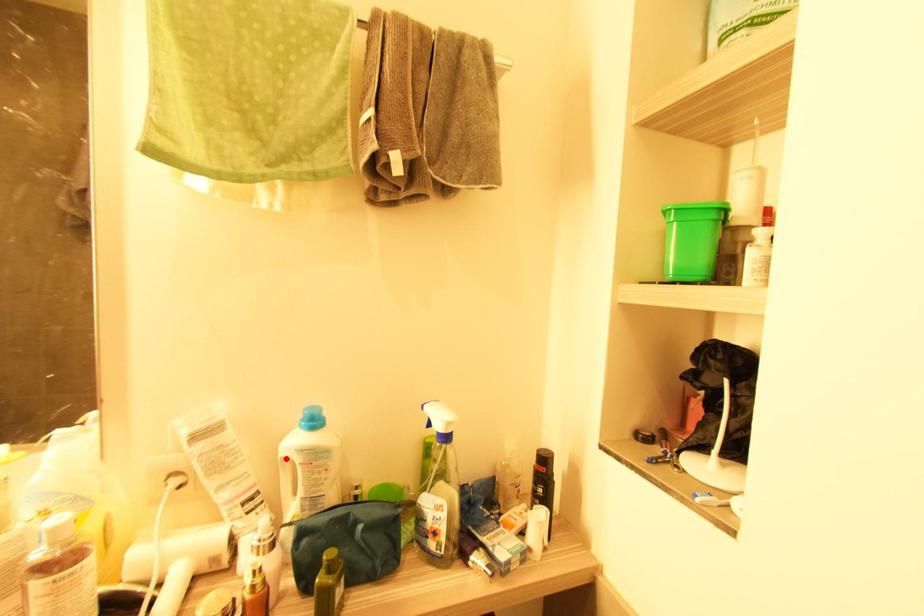
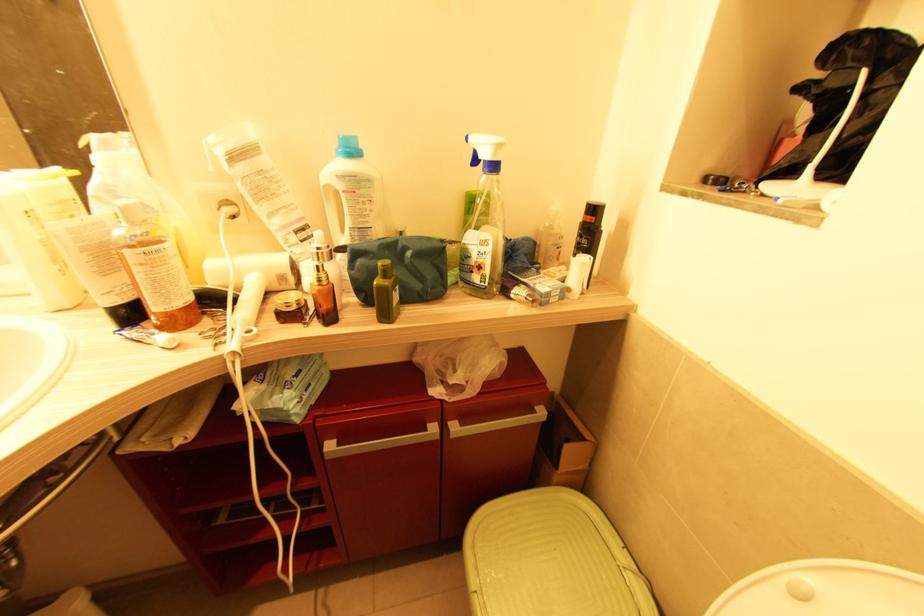
Find the pixel in the second image that matches the highlighted location in the first image.

(329, 188)